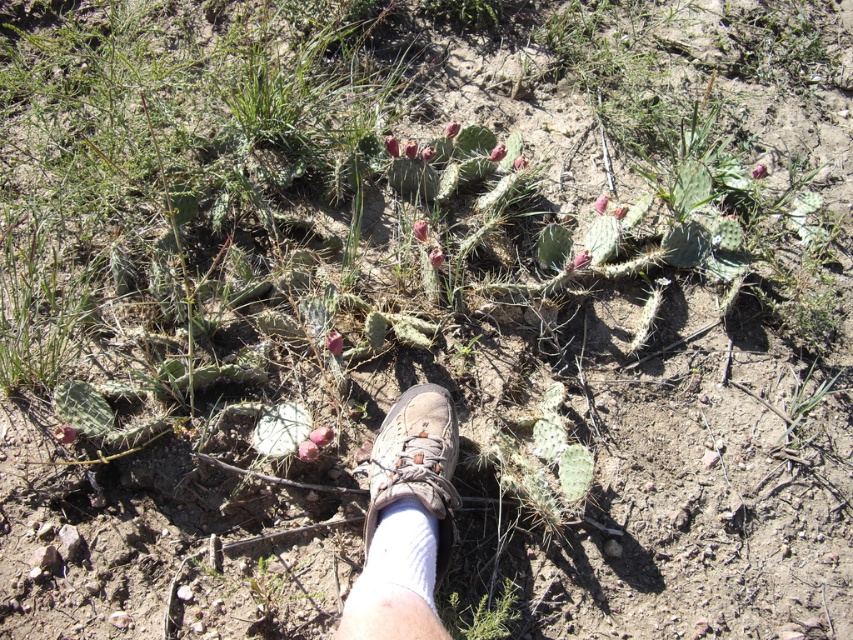
Based on the photo, does brown suede shoe at center have a greater height compared to green spiky cactus at lower center?

Indeed, brown suede shoe at center has a greater height compared to green spiky cactus at lower center.

Who is more forward, (408, 428) or (480, 618)?

Positioned in front is point (480, 618).

Locate an element on the screen. Image resolution: width=853 pixels, height=640 pixels. brown suede shoe at center is located at coordinates (416, 461).